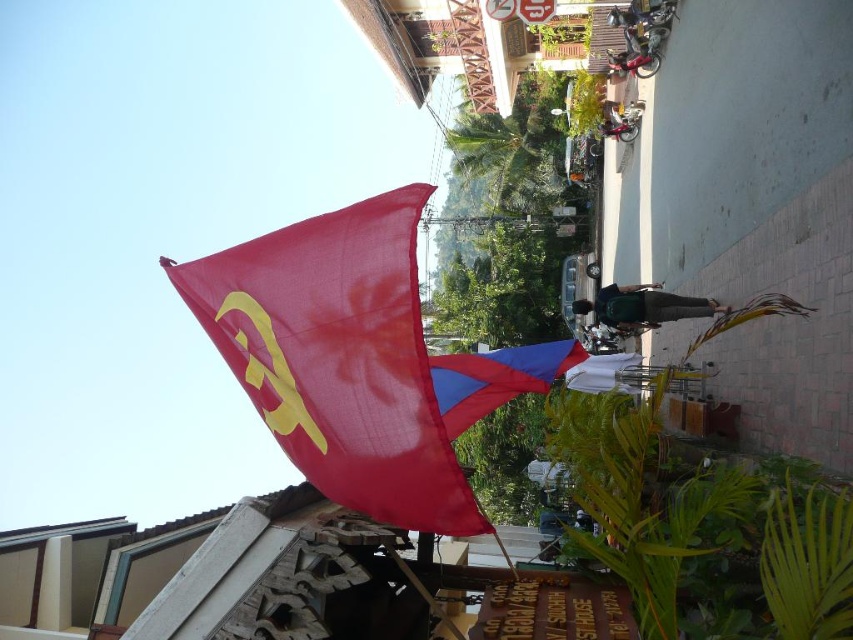
You are standing in the street scene and want to take a photo. There are two points marked in the image, point 1 at coordinates point (x=315, y=380) and point 2 at coordinates point (x=554, y=344). Which point will appear larger in your photo?

Point (x=315, y=380) is closer to the camera than point (x=554, y=344), so it will appear larger in the photo.

You are a photographer standing on the sidewalk. You want to capture both the matte red flag at upper left and the blue fabric kite at center in a single shot. Which object should you frame closer to the bottom of your camera viewfinder to ensure both are fully visible?

The blue fabric kite at center should be framed closer to the bottom of the camera viewfinder because the matte red flag at upper left is much taller than the blue fabric kite at center. This way, the taller flag will occupy the upper part of the frame, and the shorter kite will be positioned lower, ensuring both fit within the shot.